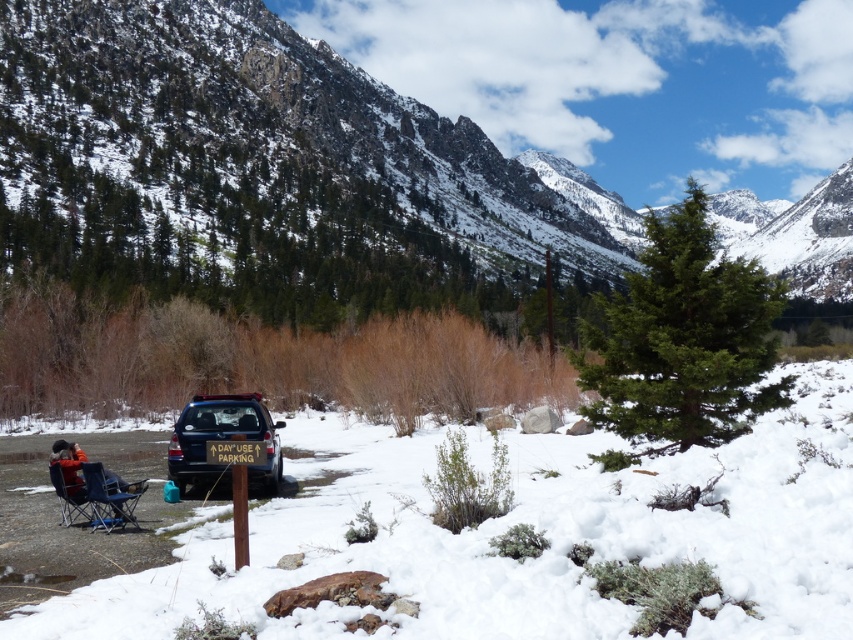
You are standing at the edge of the snow covered ground looking towards the parking area. There are two points marked in the image. Which point is closer to you, point (419,620) or point (91,525)?

Point (419,620) is closer to you than point (91,525).

Looking at this image, you are standing at the edge of the parking area and want to walk to the two points marked in the image. Which point, point (554, 214) or point (73, 518), is closer to you?

Point (554, 214) is closer to you because it is further to the viewer than point (73, 518), meaning it is nearer in the scene.